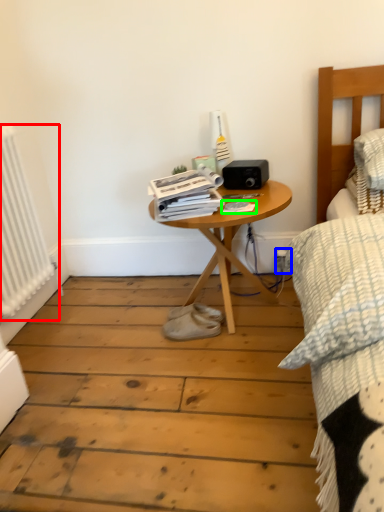
Question: Which object is positioned farthest from radiator (highlighted by a red box)? Select from electric outlet (highlighted by a blue box) and magazine (highlighted by a green box).

Choices:
 (A) electric outlet
 (B) magazine

Answer: (A)